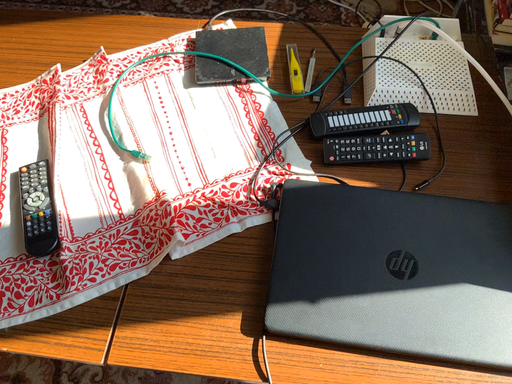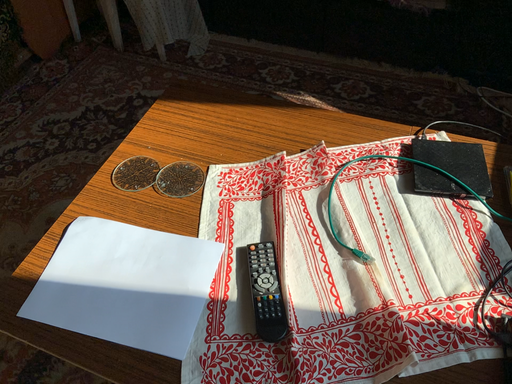
Question: How did the camera likely rotate when shooting the video?

Choices:
 (A) rotated downward
 (B) rotated upward

Answer: (B)